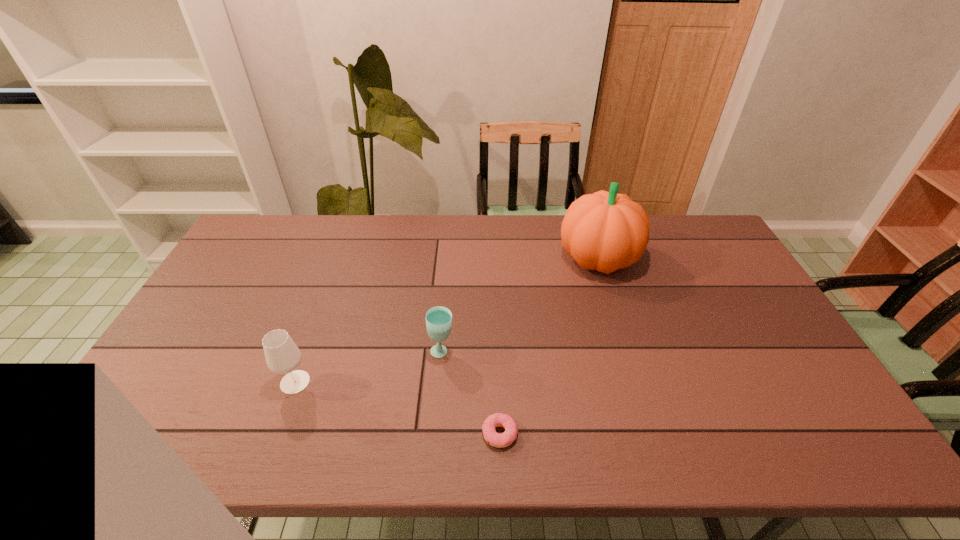
Locate an element on the screen. free location that satisfies the following two spatial constraints: 1. on the back side of the left glass; 2. on the left side of the pumpkin is located at coordinates (341, 259).

Identify the location of free space in the image that satisfies the following two spatial constraints: 1. on the front side of the third shortest object; 2. on the right side of the shortest object. The width and height of the screenshot is (960, 540). (276, 434).